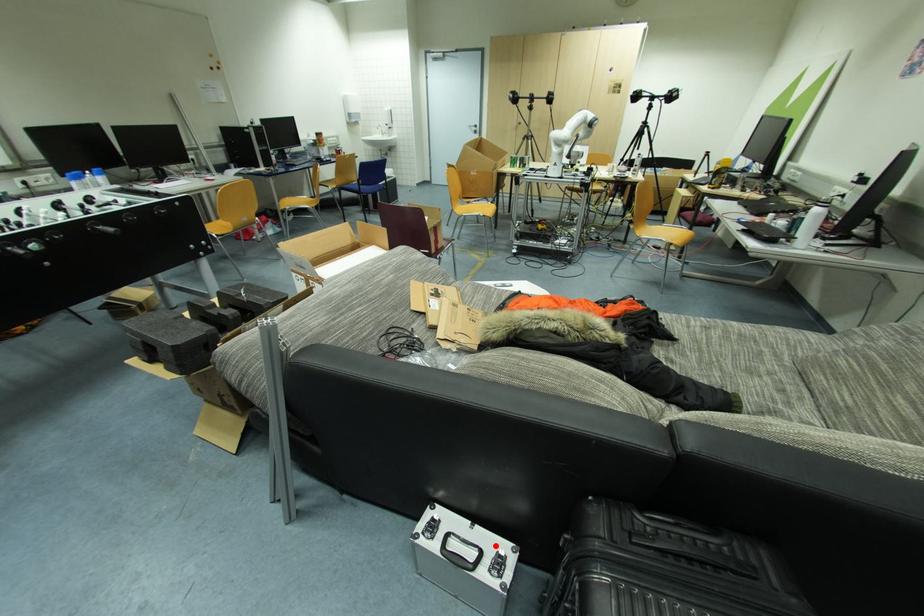
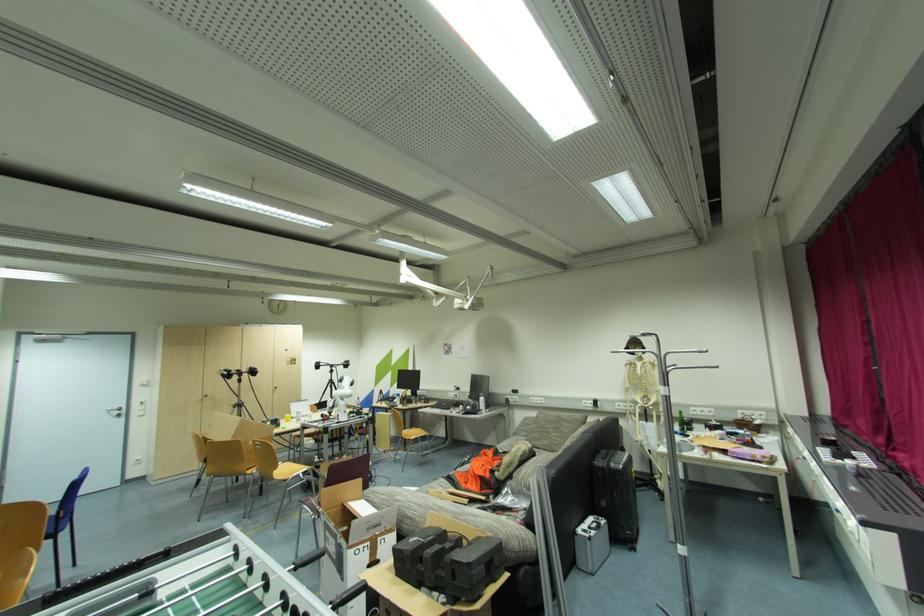
In the second image, find the point that corresponds to the highlighted location in the first image.

(593, 520)